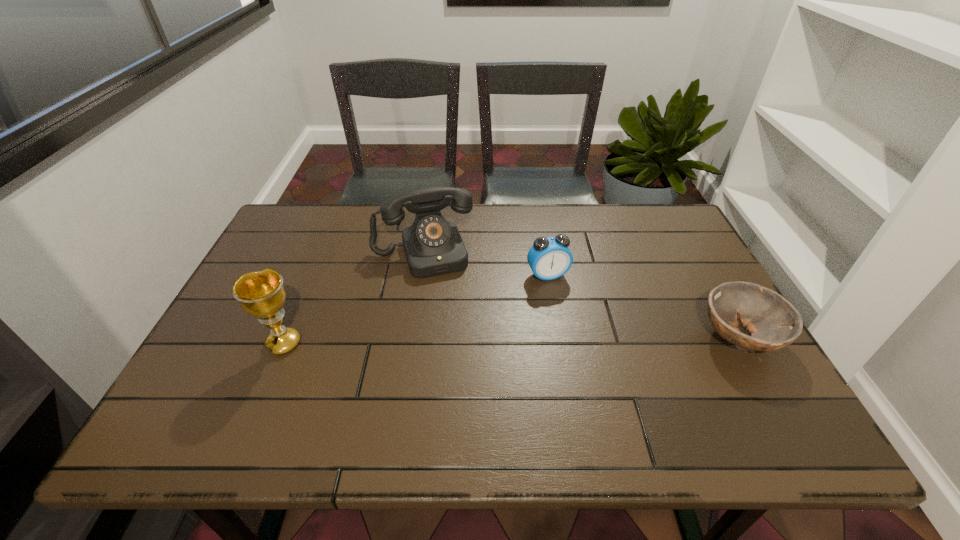
Locate an element on the screen. This screenshot has height=540, width=960. blank space located 0.160m on the dial of the third object from right to left is located at coordinates pyautogui.click(x=445, y=319).

What are the coordinates of `free location located 0.240m on the face of the alarm clock` in the screenshot? It's located at (589, 352).

At what (x,y) coordinates should I click in order to perform the action: click on vacant space positioned 0.140m on the face of the alarm clock. Please return your answer as a coordinate pair (x, y). The height and width of the screenshot is (540, 960). Looking at the image, I should click on (574, 321).

Find the location of a particular element. free space located on the face of the alarm clock is located at coordinates (580, 333).

The width and height of the screenshot is (960, 540). In order to click on object that is positioned at the far edge in this screenshot , I will do `click(433, 246)`.

You are a GUI agent. You are given a task and a screenshot of the screen. Output one action in this format:
    pyautogui.click(x=<x>, y=<y>)
    Task: Click on the object present at the near edge
    The image size is (960, 540).
    Given the screenshot: What is the action you would take?
    pyautogui.click(x=774, y=323)

Identify the location of object that is at the left edge. (261, 294).

You are a GUI agent. You are given a task and a screenshot of the screen. Output one action in this format:
    pyautogui.click(x=<x>, y=<y>)
    Task: Click on the object positioned at the right edge
    Image resolution: width=960 pixels, height=540 pixels.
    Given the screenshot: What is the action you would take?
    (774, 323)

What are the coordinates of `object present at the near right corner` in the screenshot? It's located at (774, 323).

The width and height of the screenshot is (960, 540). I want to click on vacant space at the far edge of the desktop, so click(350, 212).